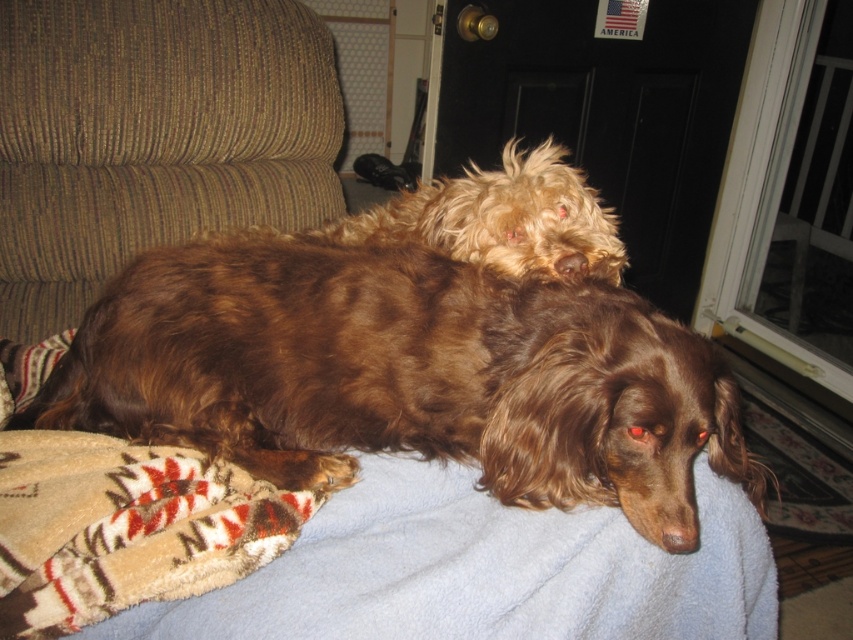
In the scene shown: You are trying to determine the positions of two points in the image. The first point, point (846, 307), and the second point, point (354, 224). Which point is closer to you?

Point (846, 307) is further to the viewer than point (354, 224), so point (354, 224) is closer to you.

You are a photographer standing at a certain distance from the brown furry dog at center. You want to take a closeup photo of the dog without getting too close. If your camera has a maximum zoom range of 50 inches, can you capture the dog in focus without moving closer?

The brown furry dog at center and camera are 31.14 inches apart from each other. Since the camera has a maximum zoom range of 50 inches, which is greater than the distance between them, you can capture the dog in focus without moving closer.

You are a delivery person holding a package that requires a signature. You see the transparent glass door at upper right and the fuzzy brown dog at upper center. Which object is closer to you, the delivery person, so you can reach it first?

The fuzzy brown dog at upper center is closer to you than the transparent glass door at upper right, so you can reach it first.